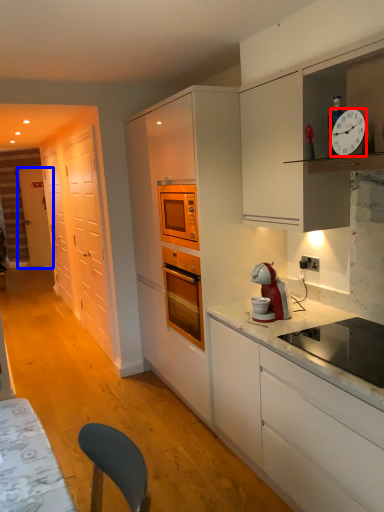
Question: Which object appears closest to the camera in this image, clock (highlighted by a red box) or door (highlighted by a blue box)?

Choices:
 (A) clock
 (B) door

Answer: (A)